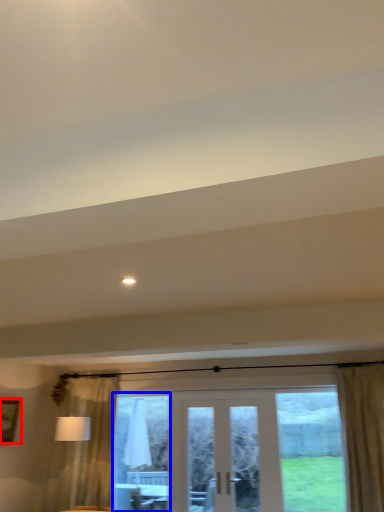
Question: Which object appears farthest to the camera in this image, picture frame (highlighted by a red box) or window screen (highlighted by a blue box)?

Choices:
 (A) picture frame
 (B) window screen

Answer: (B)